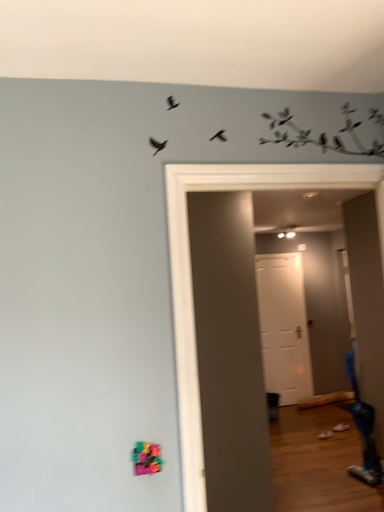
Question: Is white matte door at center taller than blue plastic swivel chair at lower right?

Choices:
 (A) yes
 (B) no

Answer: (A)

Question: Could you tell me if white matte door at center is facing blue plastic swivel chair at lower right?

Choices:
 (A) yes
 (B) no

Answer: (A)

Question: From the image's perspective, is white matte door at center beneath blue plastic swivel chair at lower right?

Choices:
 (A) yes
 (B) no

Answer: (B)

Question: Is white matte door at center in front of blue plastic swivel chair at lower right?

Choices:
 (A) no
 (B) yes

Answer: (A)

Question: Can you confirm if white matte door at center is shorter than blue plastic swivel chair at lower right?

Choices:
 (A) no
 (B) yes

Answer: (A)

Question: Is white matte door at center beside blue plastic swivel chair at lower right?

Choices:
 (A) no
 (B) yes

Answer: (A)

Question: Is blue plastic swivel chair at lower right facing away from white matte door at center?

Choices:
 (A) yes
 (B) no

Answer: (B)

Question: From a real-world perspective, is blue plastic swivel chair at lower right physically below white matte door at center?

Choices:
 (A) no
 (B) yes

Answer: (B)

Question: Considering the relative sizes of blue plastic swivel chair at lower right and white matte door at center in the image provided, is blue plastic swivel chair at lower right taller than white matte door at center?

Choices:
 (A) yes
 (B) no

Answer: (B)

Question: From a real-world perspective, is blue plastic swivel chair at lower right on white matte door at center?

Choices:
 (A) no
 (B) yes

Answer: (A)

Question: Is blue plastic swivel chair at lower right at the left side of white matte door at center?

Choices:
 (A) yes
 (B) no

Answer: (B)

Question: Is the position of blue plastic swivel chair at lower right less distant than that of white matte door at center?

Choices:
 (A) no
 (B) yes

Answer: (B)

Question: Is point (349, 359) positioned closer to the camera than point (276, 389)?

Choices:
 (A) farther
 (B) closer

Answer: (B)